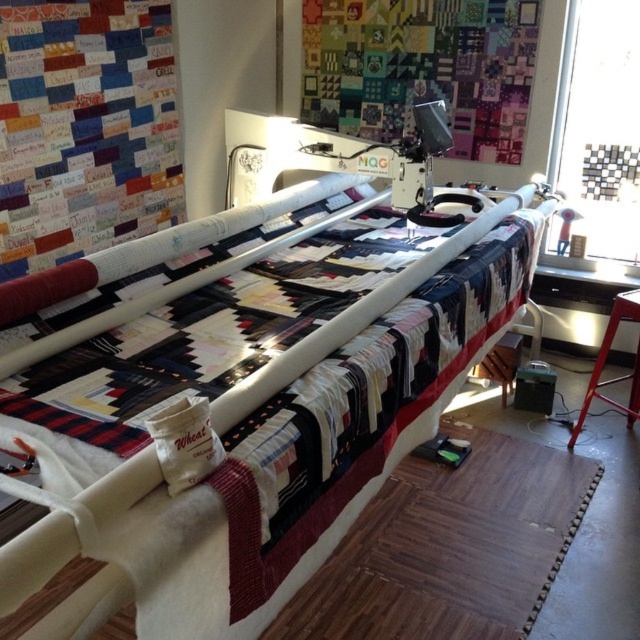
Does white quilted bed at center have a lesser width compared to metallic red stool at lower right?

No.

Is white quilted bed at center positioned in front of metallic red stool at lower right?

Yes, it is.

Describe the element at coordinates (268, 426) in the screenshot. The height and width of the screenshot is (640, 640). I see `white quilted bed at center` at that location.

Find the location of a particular element. This screenshot has width=640, height=640. white quilted bed at center is located at coordinates (268, 426).